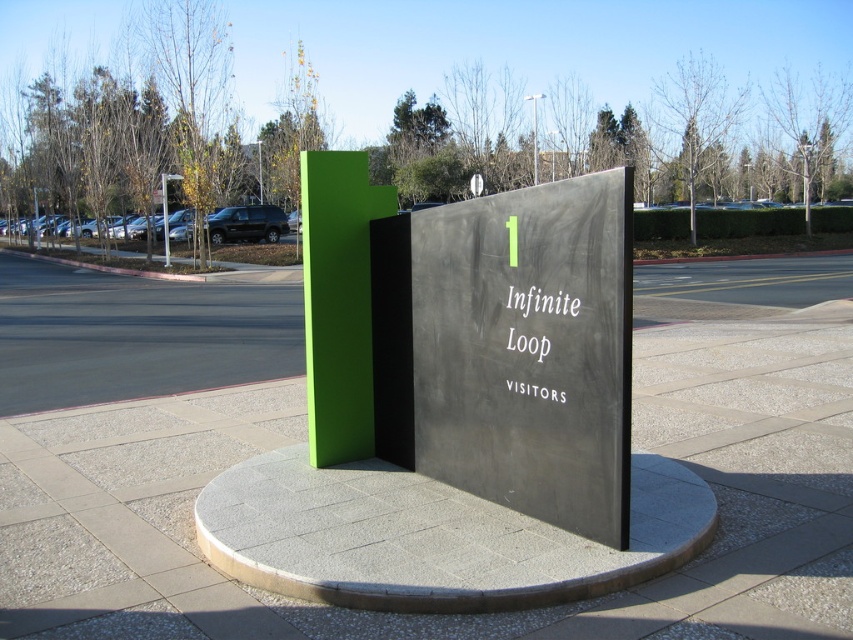
Consider the image. You are standing at the point marked by the coordinates point [486,614]. Based on the scene description, what type of surface are you currently standing on?

The point [486,614] is on gray concrete pavement at center, so you are standing on gray concrete pavement.

You are a delivery driver who needs to park your truck between the black polished stone sign at center and the metallic pole at center. Your truck is 12 meters long. Can you fit your truck in that space?

The distance between the black polished stone sign at center and the metallic pole at center is 34.32 meters, so yes, the truck can fit in the space between them since it is longer than the truck.